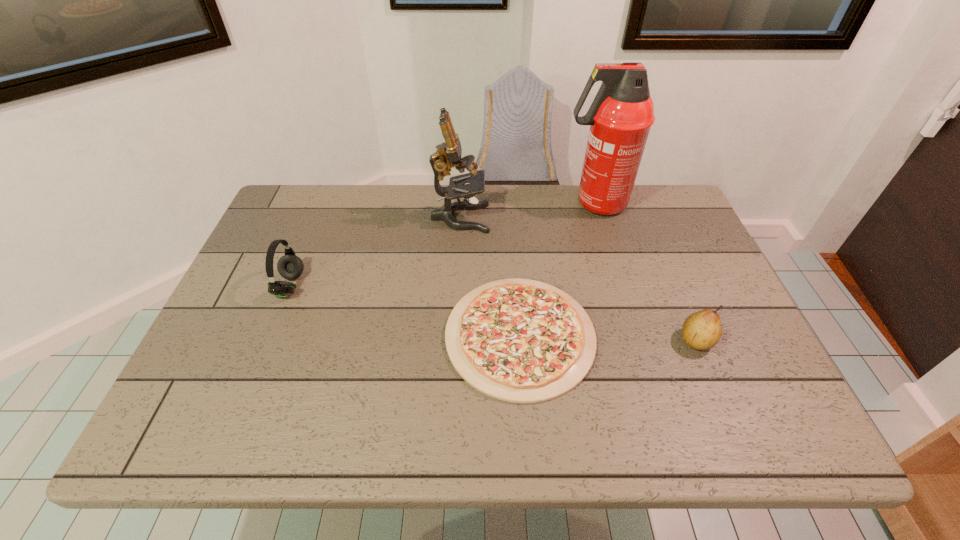
The width and height of the screenshot is (960, 540). I want to click on free point that satisfies the following two spatial constraints: 1. at the eyepieces of the pear; 2. on the left side of the fourth shortest object, so click(454, 340).

You are a GUI agent. You are given a task and a screenshot of the screen. Output one action in this format:
    pyautogui.click(x=<x>, y=<y>)
    Task: Click on the free point that satisfies the following two spatial constraints: 1. on the trigger side of the fire extinguisher; 2. on the front side of the pizza
    This screenshot has height=540, width=960.
    Given the screenshot: What is the action you would take?
    pyautogui.click(x=634, y=336)

Locate an element on the screen. The height and width of the screenshot is (540, 960). vacant region that satisfies the following two spatial constraints: 1. on the ear cups of the headset; 2. on the back side of the fourth tallest object is located at coordinates (268, 340).

Locate an element on the screen. vacant space that satisfies the following two spatial constraints: 1. at the eyepieces of the fourth tallest object; 2. on the right side of the fourth shortest object is located at coordinates (454, 340).

You are a GUI agent. You are given a task and a screenshot of the screen. Output one action in this format:
    pyautogui.click(x=<x>, y=<y>)
    Task: Click on the vacant space that satisfies the following two spatial constraints: 1. at the eyepieces of the fourth shortest object; 2. on the right side of the shortest object
    
    Given the screenshot: What is the action you would take?
    pyautogui.click(x=454, y=336)